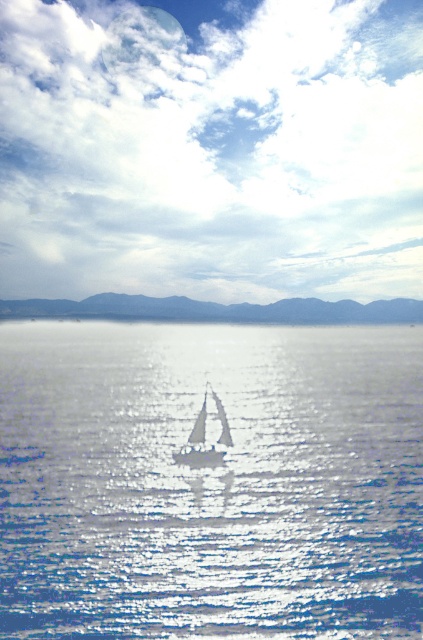
You are a photographer trying to capture the blue matte mountains at center in your shot. Based on the scene description, where should you position your camera to ensure the mountains are centered in the frame?

The blue matte mountains at center are already positioned at the center of the frame at point coordinates (x=219, y=308), so positioning the camera to center on those coordinates would ensure the mountains are centered in the shot.

You are standing on the deck of the sailboat and looking towards the horizon. There are two points marked in the scene. The first point is at coordinates point (357, 566) and the second is at point (222, 408). Which point is closer to you?

Point (357, 566) is in front of point (222, 408), so it is closer to you.

You are a photographer planning to capture the glistening blue water at center and the white matte sailboat at center in a single frame. Based on their sizes in the image, which object would appear larger in your photo?

The glistening blue water at center appears much larger in the photo because it is described as much taller than the white matte sailboat at center.